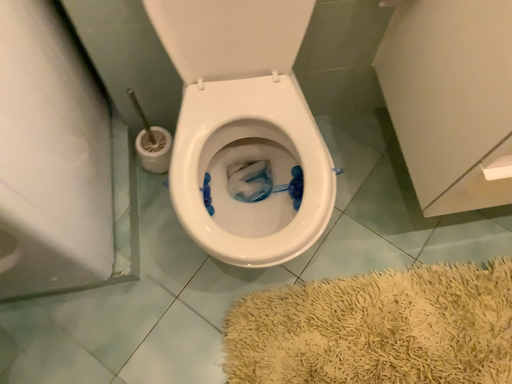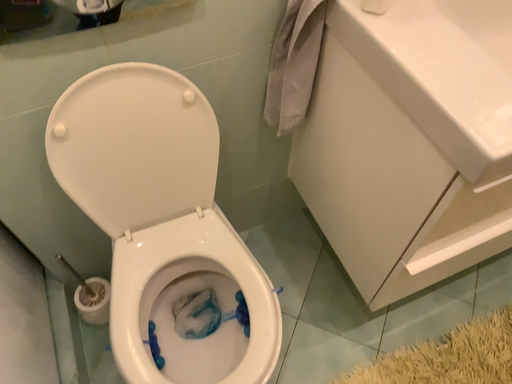
Question: Which way did the camera rotate in the video?

Choices:
 (A) rotated downward
 (B) rotated upward

Answer: (B)